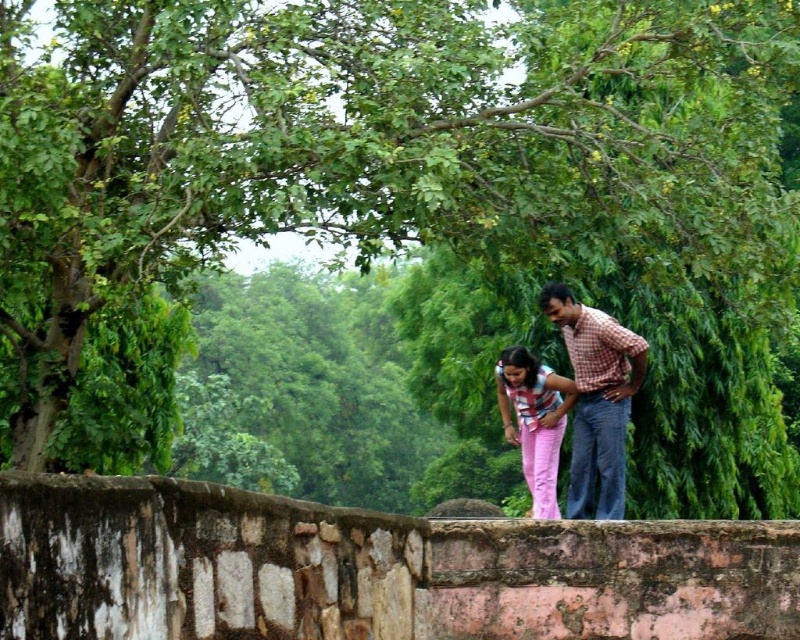
You are a photographer trying to capture a clear shot of both the checkered fabric shirt at center and the striped fabric shirt at center. Since you want both shirts to be visible, which one should you focus on first to ensure the other remains in focus?

You should focus on the checkered fabric shirt at center first because it is in front of the striped fabric shirt at center. By focusing on the closer object, the background object will still be in focus due to the depth of field, ensuring both shirts are visible.

You are standing on the stone bridge and want to take a photo of two points marked on the bridge. The points are labeled as point 1 at coordinates point (600, 424) and point 2 at coordinates point (528, 392). To ensure both points are in focus, which point should you focus on first?

Point 1 at coordinates point (600, 424) is closer to the camera than point 2 at coordinates point (528, 392). Therefore, you should focus on point 1 first to ensure both points are in focus.

You are a tailor observing two shirts on a stone bridge. The checkered fabric shirt at center and the striped fabric shirt at center. Which shirt has a larger width?

The checkered fabric shirt at center has a larger width than the striped fabric shirt at center according to the description.